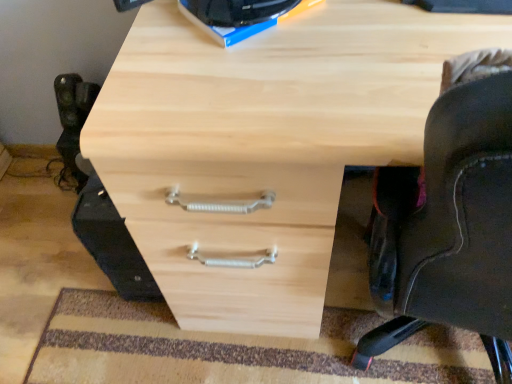
What is the approximate width of black leather swivel chair at right?

58.12 centimeters.

This screenshot has height=384, width=512. What are the coordinates of `black leather swivel chair at right` in the screenshot? It's located at (450, 219).

The height and width of the screenshot is (384, 512). Describe the element at coordinates (450, 219) in the screenshot. I see `black leather swivel chair at right` at that location.

Identify the location of black leather swivel chair at right. The image size is (512, 384). tap(450, 219).